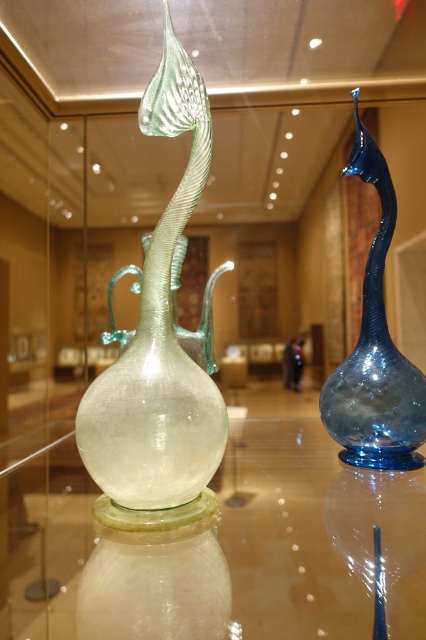
Question: Which point is farther to the camera?

Choices:
 (A) (183, 124)
 (B) (420, 550)

Answer: (A)

Question: Which point is closer to the camera?

Choices:
 (A) (287, 577)
 (B) (190, 467)

Answer: (A)

Question: Is transparent glass table at center further to the viewer compared to transparent glass vase at center?

Choices:
 (A) no
 (B) yes

Answer: (A)

Question: Does transparent glass vase at center appear over blue glass vase at right?

Choices:
 (A) no
 (B) yes

Answer: (A)

Question: Is transparent glass table at center thinner than blue glass vase at right?

Choices:
 (A) yes
 (B) no

Answer: (B)

Question: Which object is closer to the camera taking this photo?

Choices:
 (A) transparent glass table at center
 (B) transparent glass vase at center

Answer: (A)